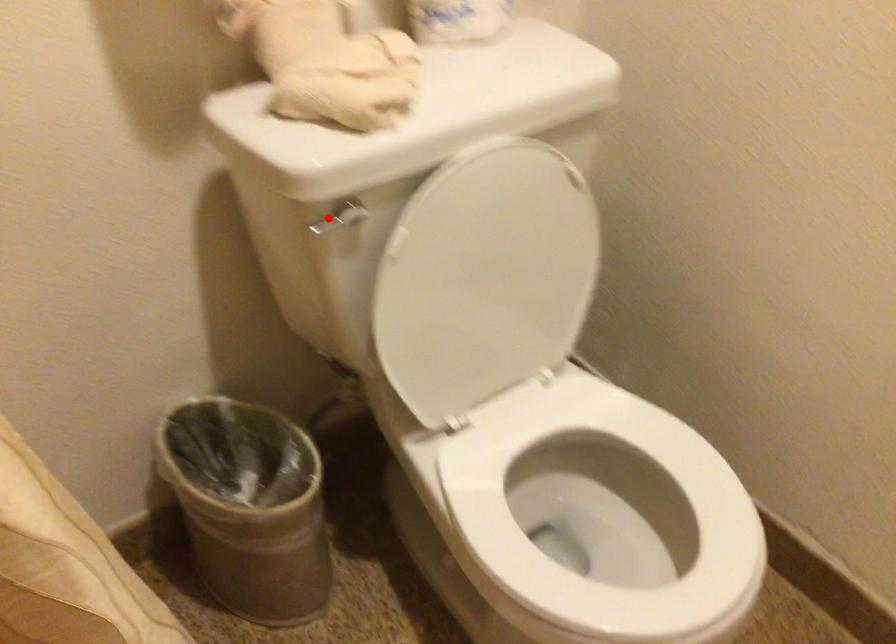
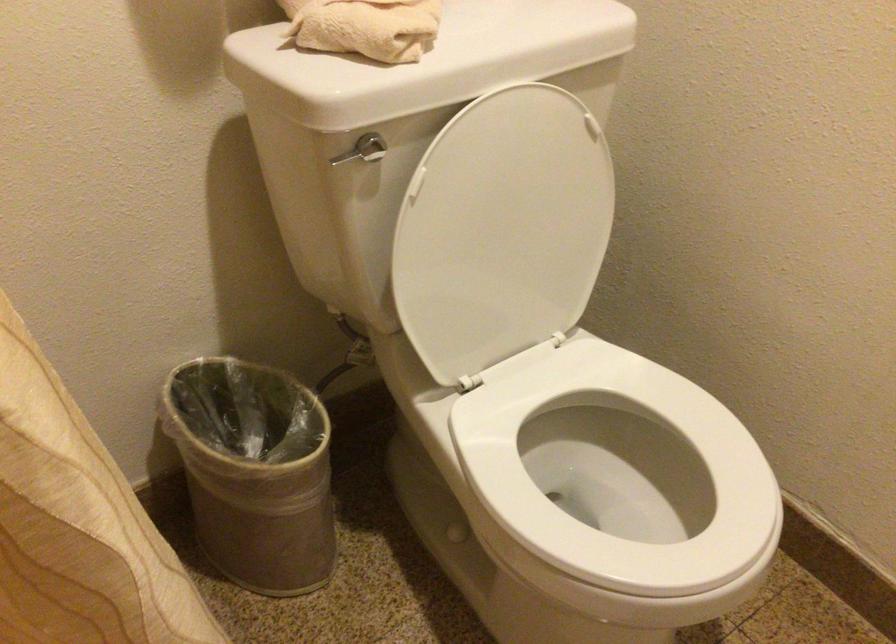
Locate, in the second image, the point that corresponds to the highlighted location in the first image.

(348, 155)